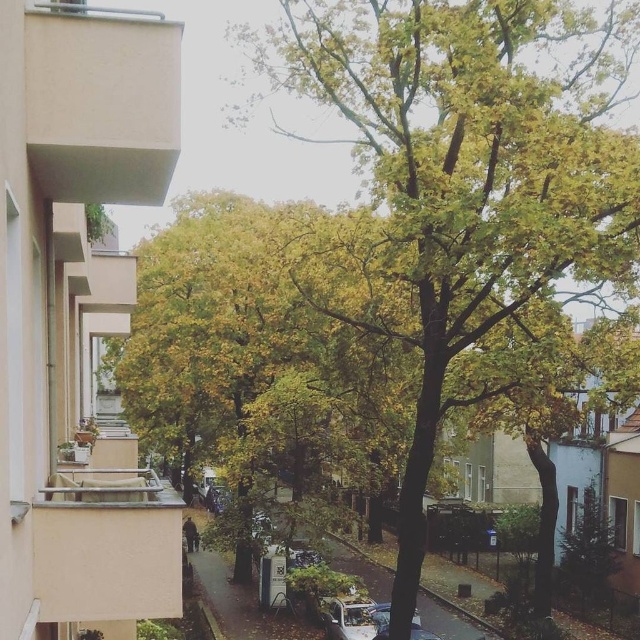
Question: Which of the following is the farthest from the observer?

Choices:
 (A) green leafy tree at center
 (B) metallic silver car at lower center

Answer: (B)

Question: Which point appears closest to the camera in this image?

Choices:
 (A) (412, 637)
 (B) (618, 188)

Answer: (B)

Question: Which point appears farthest from the camera in this image?

Choices:
 (A) (364, 618)
 (B) (582, 36)

Answer: (A)

Question: Does green leafy tree at center have a smaller size compared to metallic silver car at lower center?

Choices:
 (A) no
 (B) yes

Answer: (A)

Question: Does green leafy tree at center have a greater width compared to metallic silver car at lower center?

Choices:
 (A) yes
 (B) no

Answer: (A)

Question: Is green leafy tree at center positioned in front of metallic silver car at lower center?

Choices:
 (A) yes
 (B) no

Answer: (A)